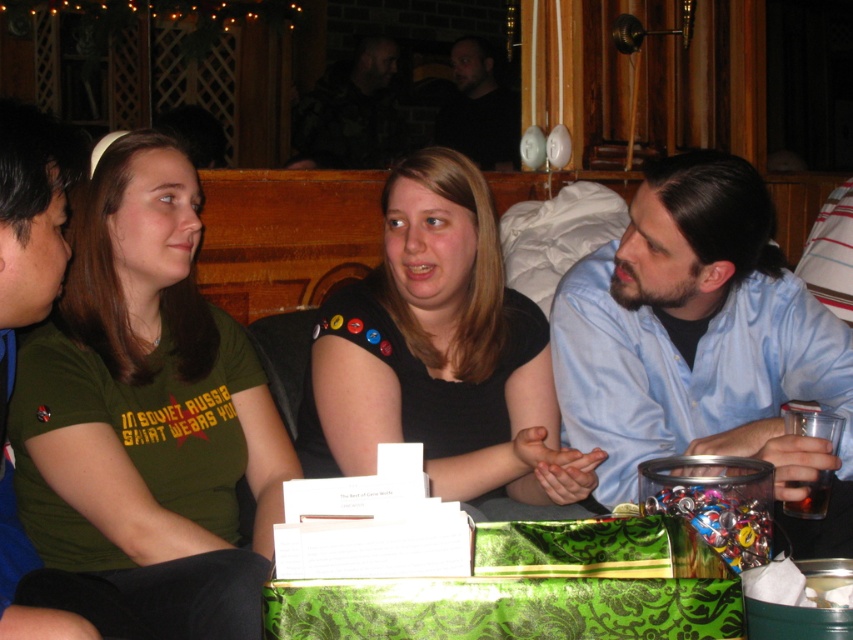
Question: Does black matte shirt at center appear under black matte shirt at upper center?

Choices:
 (A) no
 (B) yes

Answer: (B)

Question: Is green matte shirt at left further to camera compared to translucent glass cup at lower right?

Choices:
 (A) yes
 (B) no

Answer: (B)

Question: Does blue shirt at center have a lesser width compared to clear plastic cup at lower right?

Choices:
 (A) yes
 (B) no

Answer: (B)

Question: Which object is the closest to the black matte shirt at center?

Choices:
 (A) green fabric shirt at left
 (B) blue shirt at center
 (C) clear plastic cup at lower right
 (D) green matte shirt at left

Answer: (B)

Question: Which object is closer to the camera taking this photo?

Choices:
 (A) black matte shirt at center
 (B) blue shirt at center

Answer: (B)

Question: Which object is farther from the camera taking this photo?

Choices:
 (A) clear plastic cup at lower right
 (B) green fabric shirt at left

Answer: (A)